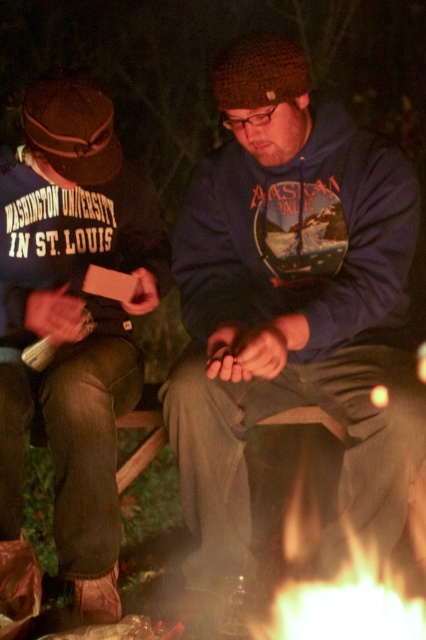
You are standing at the campfire and want to throw a marshmallow to the person closer to you. Which point should you aim for, point (285, 148) or point (100, 506)?

Point (285, 148) is in front of point (100, 506), so you should aim for point (285, 148) to reach the person closer to you.

You are a photographer trying to capture the scene with the blue fleece hoodie at center and the flametransparentfire at lower center. Which object should appear closer to the camera in your photo?

The blue fleece hoodie at center should appear closer to the camera because the flametransparentfire at lower center is positioned behind it.

You are standing in front of the image and want to locate the blue fleece hoodie at center. Can you tell me its exact coordinates in the image?

The blue fleece hoodie at center is located at coordinates point (290, 307).